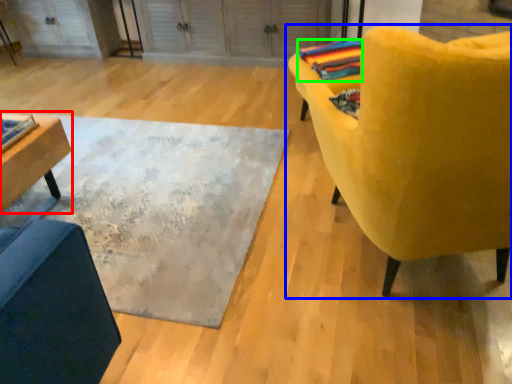
Question: Considering the real-world distances, which object is farthest from table (highlighted by a red box)? chair (highlighted by a blue box) or blanket (highlighted by a green box)?

Choices:
 (A) chair
 (B) blanket

Answer: (B)